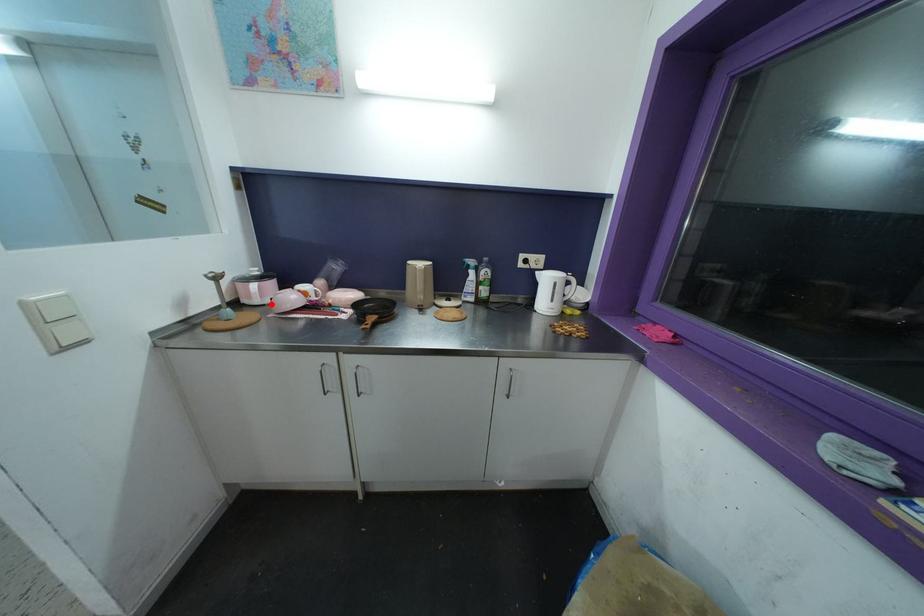
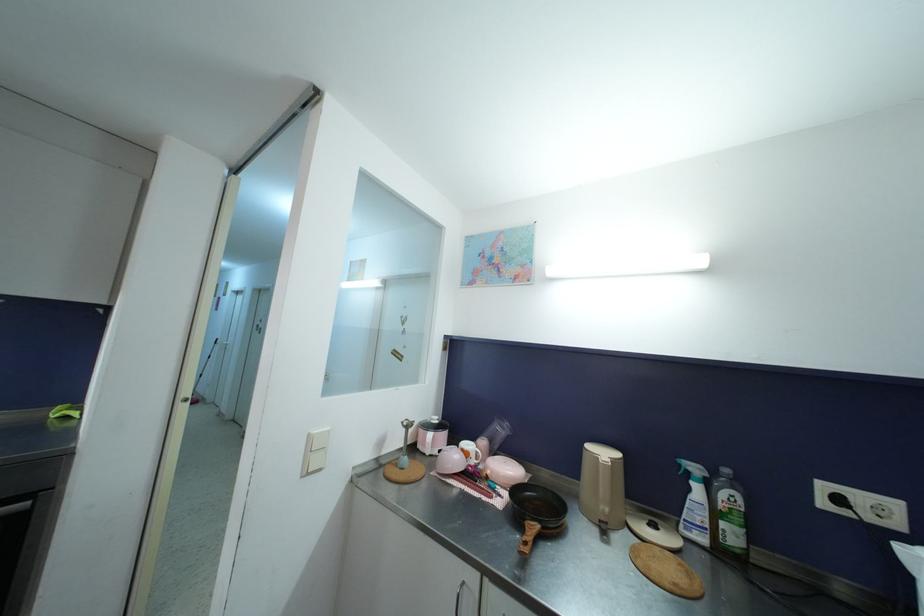
Where in the second image is the point corresponding to the highlighted location from the first image?

(439, 456)